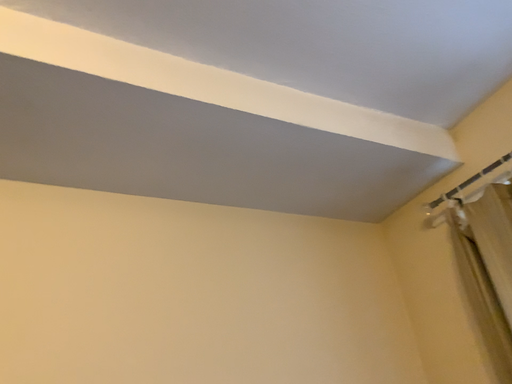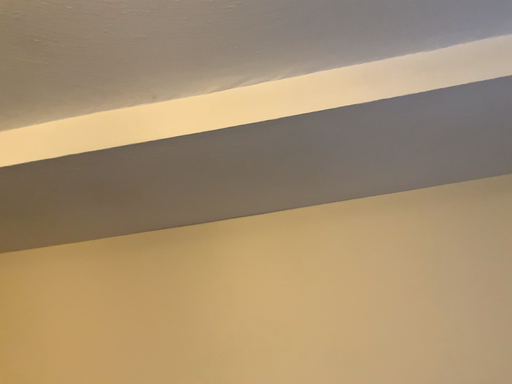
Question: Which way did the camera rotate in the video?

Choices:
 (A) rotated left
 (B) rotated right

Answer: (A)